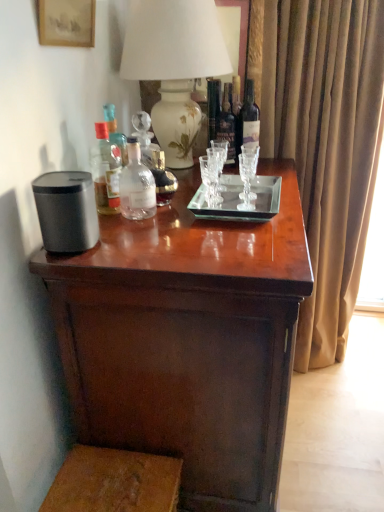
Find the location of a particular element. free space in front of clear glass bottle at center, which ranks as the third bottle in right-to-left order is located at coordinates (163, 226).